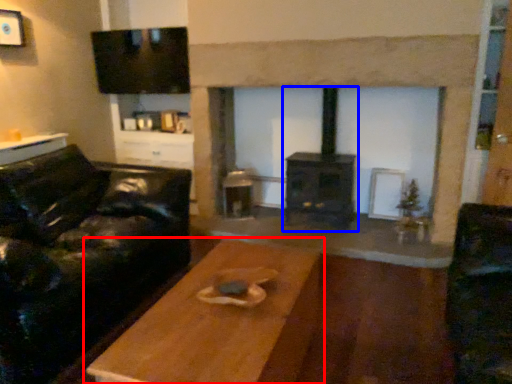
Question: Which object is further to the camera taking this photo, table (highlighted by a red box) or wood burning stove (highlighted by a blue box)?

Choices:
 (A) table
 (B) wood burning stove

Answer: (B)